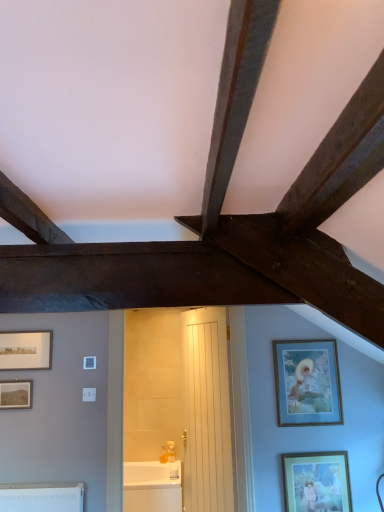
Question: Considering the relative sizes of white glossy bathtub at center and matte silver picture frame at left, which is the fourth picture frame in bottom-to-top order, in the image provided, is white glossy bathtub at center shorter than matte silver picture frame at left, which is the fourth picture frame in bottom-to-top order,?

Choices:
 (A) no
 (B) yes

Answer: (A)

Question: Is white glossy bathtub at center further to camera compared to matte silver picture frame at left, which is the fourth picture frame in bottom-to-top order?

Choices:
 (A) yes
 (B) no

Answer: (A)

Question: From a real-world perspective, is white glossy bathtub at center positioned over matte silver picture frame at left, which is the first picture frame in top-to-bottom order, based on gravity?

Choices:
 (A) yes
 (B) no

Answer: (B)

Question: From the image's perspective, is white glossy bathtub at center on matte silver picture frame at left, which is the first picture frame in top-to-bottom order?

Choices:
 (A) yes
 (B) no

Answer: (B)

Question: Is matte silver picture frame at left, which is the first picture frame in top-to-bottom order, surrounded by white glossy bathtub at center?

Choices:
 (A) yes
 (B) no

Answer: (B)

Question: Is white glossy bathtub at center oriented away from matte silver picture frame at left, which is the fourth picture frame in bottom-to-top order?

Choices:
 (A) no
 (B) yes

Answer: (A)

Question: From the image's perspective, does matte gold picture frame at lower right, acting as the fourth picture frame starting from the left, appear higher than white glossy bathtub at center?

Choices:
 (A) yes
 (B) no

Answer: (A)

Question: Is matte gold picture frame at lower right, which appears as the 1th picture frame when viewed from the right, smaller than white glossy bathtub at center?

Choices:
 (A) yes
 (B) no

Answer: (A)

Question: Would you say matte gold picture frame at lower right, acting as the fourth picture frame starting from the left, is outside white glossy bathtub at center?

Choices:
 (A) no
 (B) yes

Answer: (B)

Question: From the image's perspective, is matte gold picture frame at lower right, which is the 4th picture frame from top to bottom, beneath white glossy bathtub at center?

Choices:
 (A) no
 (B) yes

Answer: (A)

Question: Can you confirm if matte gold picture frame at lower right, which is the first picture frame in bottom-to-top order, is bigger than white glossy bathtub at center?

Choices:
 (A) yes
 (B) no

Answer: (B)

Question: Is matte gold picture frame at lower right, which is the first picture frame in bottom-to-top order, positioned behind white glossy bathtub at center?

Choices:
 (A) yes
 (B) no

Answer: (B)

Question: Is white glossy bathtub at center outside of matte gold picture frame at lower right, acting as the fourth picture frame starting from the left?

Choices:
 (A) yes
 (B) no

Answer: (A)